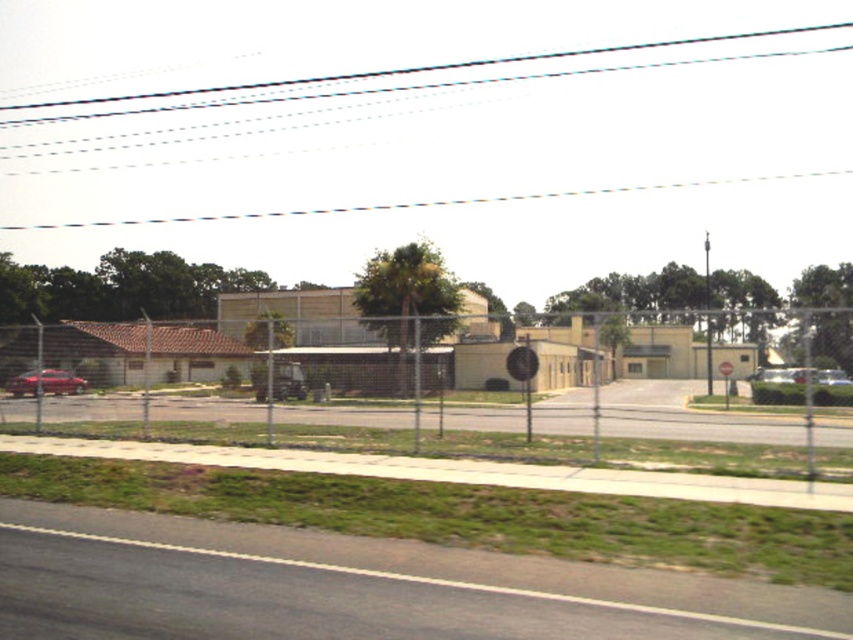
What do you see at coordinates (682, 419) in the screenshot? I see `metallic chain-link fence at center` at bounding box center [682, 419].

Is metallic chain-link fence at center smaller than clear plastic power line at upper center?

Indeed, metallic chain-link fence at center has a smaller size compared to clear plastic power line at upper center.

Who is more distant from viewer, (554, 420) or (93, 99)?

The point (93, 99) is behind.

What are the coordinates of `metallic chain-link fence at center` in the screenshot? It's located at (682, 419).

Can you confirm if metallic chain-link fence at center is positioned below shiny red sedan at left?

Yes, metallic chain-link fence at center is below shiny red sedan at left.

Can you confirm if metallic chain-link fence at center is positioned above shiny red sedan at left?

Incorrect, metallic chain-link fence at center is not positioned above shiny red sedan at left.

This screenshot has width=853, height=640. I want to click on metallic chain-link fence at center, so click(682, 419).

Locate an element on the screen. The width and height of the screenshot is (853, 640). metallic chain-link fence at center is located at coordinates (682, 419).

Based on the photo, is clear plastic power line at upper center to the left of shiny red sedan at left from the viewer's perspective?

Incorrect, clear plastic power line at upper center is not on the left side of shiny red sedan at left.

Between point (695, 38) and point (25, 374), which one is positioned behind?

The point (695, 38) is behind.

Image resolution: width=853 pixels, height=640 pixels. Identify the location of clear plastic power line at upper center. (421, 67).

This screenshot has height=640, width=853. Find the location of `clear plastic power line at upper center`. clear plastic power line at upper center is located at coordinates (421, 67).